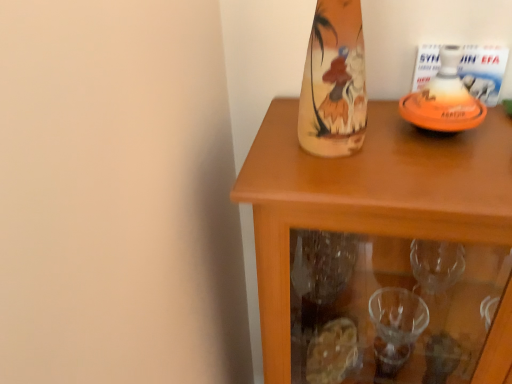
Locate an element on the screen. This screenshot has height=384, width=512. vacant area that lies in front of orange matte bottle at upper right is located at coordinates (451, 171).